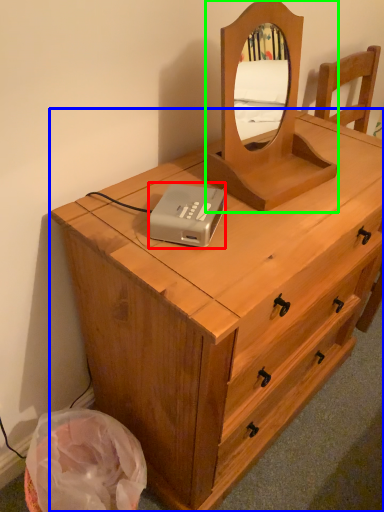
Question: Considering the real-world distances, which object is closest to cassette (highlighted by a red box)? chest of drawers (highlighted by a blue box) or mirror (highlighted by a green box).

Choices:
 (A) chest of drawers
 (B) mirror

Answer: (B)